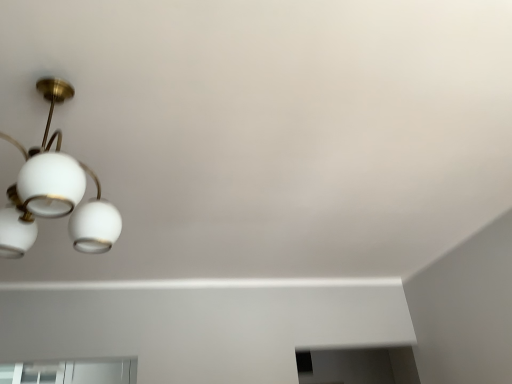
Locate an element on the screen. matte white chandelier at upper left is located at coordinates (55, 193).

Measure the distance between matte white chandelier at upper left and camera.

98.05 centimeters.

The height and width of the screenshot is (384, 512). What do you see at coordinates (55, 193) in the screenshot?
I see `matte white chandelier at upper left` at bounding box center [55, 193].

At what (x,y) coordinates should I click in order to perform the action: click on matte white chandelier at upper left. Please return your answer as a coordinate pair (x, y). Looking at the image, I should click on (55, 193).